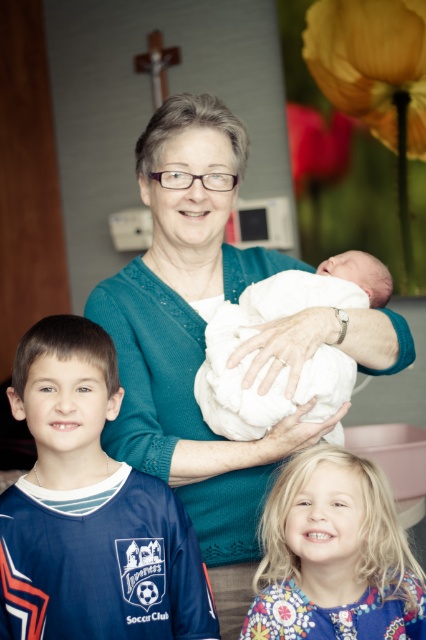
Question: Can you confirm if blue jersey at center is smaller than blonde hair at center?

Choices:
 (A) yes
 (B) no

Answer: (A)

Question: Which object is farther from the camera taking this photo?

Choices:
 (A) white soft cloth at center
 (B) blue jersey at center
 (C) teal knitted sweater at center

Answer: (A)

Question: Which of the following is the farthest from the observer?

Choices:
 (A) (120, 348)
 (B) (388, 579)
 (C) (282, 301)

Answer: (A)

Question: Is teal knitted sweater at center bigger than white soft cloth at center?

Choices:
 (A) yes
 (B) no

Answer: (A)

Question: Is teal knitted sweater at center positioned at the back of blue jersey at center?

Choices:
 (A) no
 (B) yes

Answer: (B)

Question: Based on their relative distances, which object is nearer to the blue jersey at center?

Choices:
 (A) white soft cloth at center
 (B) blonde hair at center
 (C) teal knitted sweater at center

Answer: (C)